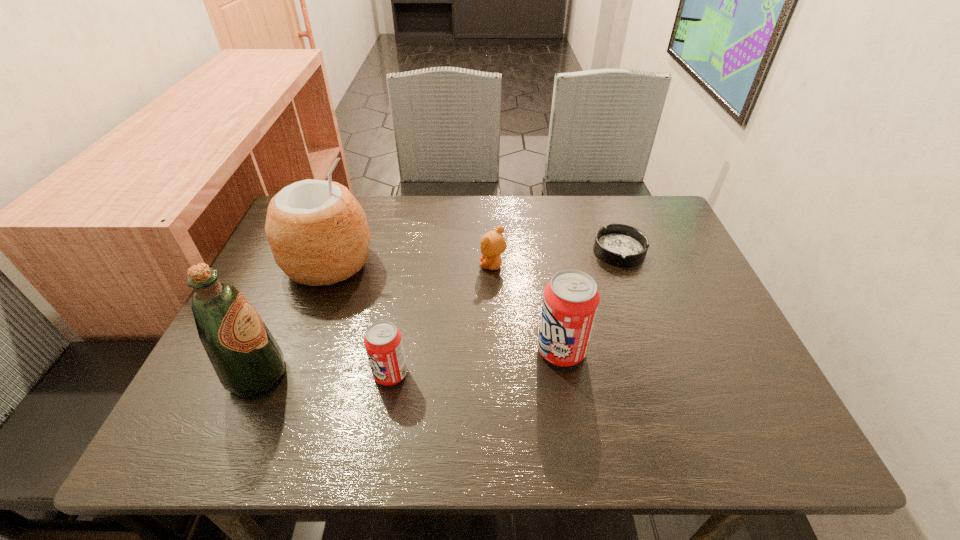
This screenshot has width=960, height=540. Find the location of `the left soda can`. the left soda can is located at coordinates (383, 342).

At what (x,y) coordinates should I click in order to perform the action: click on the shorter soda can. Please return your answer as a coordinate pair (x, y). The image size is (960, 540). Looking at the image, I should click on (383, 342).

Locate an element on the screen. The width and height of the screenshot is (960, 540). the taller soda can is located at coordinates (571, 299).

You are a GUI agent. You are given a task and a screenshot of the screen. Output one action in this format:
    pyautogui.click(x=<x>, y=<y>)
    Task: Click on the second object from right to left
    
    Given the screenshot: What is the action you would take?
    pyautogui.click(x=571, y=299)

Locate an element on the screen. the third object from right to left is located at coordinates (492, 244).

Locate an element on the screen. coconut is located at coordinates (318, 232).

Locate an element on the screen. The width and height of the screenshot is (960, 540). the shortest object is located at coordinates (622, 245).

The width and height of the screenshot is (960, 540). What are the coordinates of `ashtray` in the screenshot? It's located at (622, 245).

Find the location of a particular element. olive oil is located at coordinates (247, 359).

At what (x,y) coordinates should I click in order to perform the action: click on vacant space located on the surface of the left soda can. Please return your answer as a coordinate pair (x, y). The width and height of the screenshot is (960, 540). Looking at the image, I should click on (320, 374).